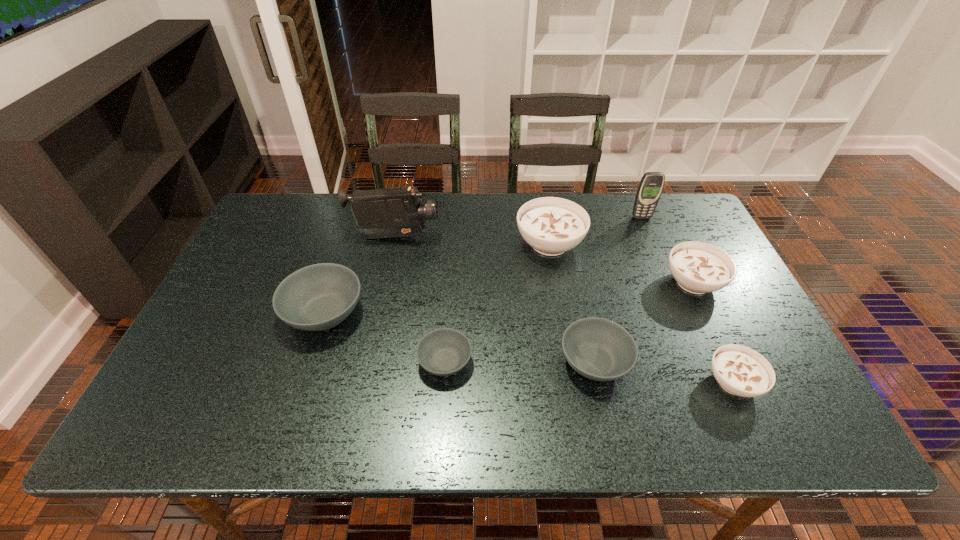
I want to click on camcorder located in the far edge section of the desktop, so click(x=391, y=212).

The width and height of the screenshot is (960, 540). I want to click on cellular telephone that is at the far edge, so click(651, 185).

I want to click on soup bowl present at the far edge, so click(x=551, y=225).

Locate an element on the screen. The image size is (960, 540). object that is at the near edge is located at coordinates (741, 371).

You are a GUI agent. You are given a task and a screenshot of the screen. Output one action in this format:
    pyautogui.click(x=<x>, y=<y>)
    Task: Click on the cellular telephone located in the right edge section of the desktop
    The image size is (960, 540).
    Given the screenshot: What is the action you would take?
    pyautogui.click(x=651, y=185)

In order to click on object at the far right corner in this screenshot , I will do `click(651, 185)`.

Image resolution: width=960 pixels, height=540 pixels. Find the location of `object at the near right corner`. object at the near right corner is located at coordinates (741, 371).

At what (x,y) coordinates should I click in order to perform the action: click on free region at the far edge of the desktop. Please return your answer as a coordinate pair (x, y). Looking at the image, I should click on (317, 226).

In the image, there is a desktop. Where is `free space at the near edge`? Image resolution: width=960 pixels, height=540 pixels. free space at the near edge is located at coordinates (430, 424).

This screenshot has height=540, width=960. I want to click on vacant space at the left edge of the desktop, so click(235, 330).